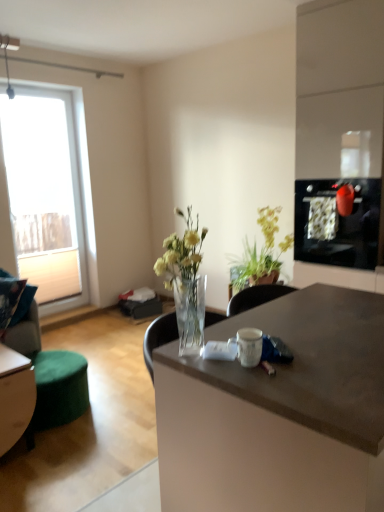
Identify the location of spots to the right of green fabric swivel chair at lower left. The height and width of the screenshot is (512, 384). pos(119,409).